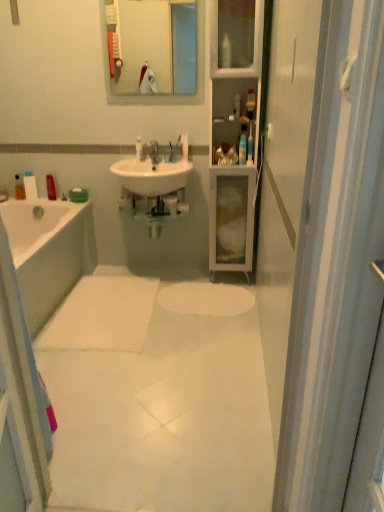
Locate an element on the screen. white smooth mat at center is located at coordinates (158, 396).

What is the approximate width of translucent plastic bottle at left, the first toiletry from the back?

It is 2.19 inches.

Identify the location of white glossy tap at center. The image size is (384, 512). (151, 151).

This screenshot has height=512, width=384. In order to click on white glossy bathtub at left in this screenshot , I will do `click(49, 253)`.

How different are the orientations of translucent plastic bottle at upper center, which ranks as the 6th toiletry in back-to-front order, and matte plastic bottle at left, the second toiletry in the back-to-front sequence, in degrees?

The angular difference between translucent plastic bottle at upper center, which ranks as the 6th toiletry in back-to-front order, and matte plastic bottle at left, the second toiletry in the back-to-front sequence, is 0.131 degrees.

Would you say translucent plastic bottle at upper center, the sixth toiletry viewed from the left, contains matte plastic bottle at left, which is the 4th toiletry from right to left?

That's incorrect, matte plastic bottle at left, which is the 4th toiletry from right to left, is not inside translucent plastic bottle at upper center, the sixth toiletry viewed from the left.

Is translucent plastic bottle at upper center, placed as the 1th toiletry when sorted from right to left, aimed at matte plastic bottle at left, which is the 4th toiletry from right to left?

No, translucent plastic bottle at upper center, placed as the 1th toiletry when sorted from right to left, is not turned towards matte plastic bottle at left, which is the 4th toiletry from right to left.

Is translucent plastic bottle at upper center, the sixth toiletry viewed from the left, at the left side of matte plastic bottle at left, positioned as the third toiletry in left-to-right order?

No.

Is white glossy tap at center looking in the opposite direction of clear glass mirror at upper center?

No, white glossy tap at center is not facing the opposite direction of clear glass mirror at upper center.

What's the angular difference between white glossy tap at center and clear glass mirror at upper center's facing directions?

white glossy tap at center and clear glass mirror at upper center are facing 1.52 degrees away from each other.

Is point (141, 153) closer to camera compared to point (201, 86)?

No.

This screenshot has width=384, height=512. I want to click on the 1st toiletry behind the translucent plastic bottle at upper center, positioned as the 2th toiletry in front-to-back order, counting from the anchor's position, so click(139, 148).

Is translucent plastic bottle at upper center, positioned as the fifth toiletry in left-to-right order, smaller than white plastic toothbrush at upper center, the fourth toiletry when ordered from back to front?

Yes, translucent plastic bottle at upper center, positioned as the fifth toiletry in left-to-right order, is smaller than white plastic toothbrush at upper center, the fourth toiletry when ordered from back to front.

Is translucent plastic bottle at upper center, positioned as the 2th toiletry in front-to-back order, oriented away from white plastic toothbrush at upper center, the third toiletry viewed from the right?

No.

Considering the positions of objects translucent plastic bottle at upper center, the second toiletry viewed from the right, and white plastic toothbrush at upper center, the fourth toiletry when ordered from back to front, in the image provided, who is more to the left, translucent plastic bottle at upper center, the second toiletry viewed from the right, or white plastic toothbrush at upper center, the fourth toiletry when ordered from back to front,?

Positioned to the left is white plastic toothbrush at upper center, the fourth toiletry when ordered from back to front.

Considering the positions of objects white glossy sink at center and white glossy tap at center in the image provided, who is more to the right, white glossy sink at center or white glossy tap at center?

From the viewer's perspective, white glossy tap at center appears more on the right side.

Can you see white glossy sink at center touching white glossy tap at center?

No, white glossy sink at center is not next to white glossy tap at center.

Is white glossy tap at center a part of white glossy sink at center?

That's incorrect, white glossy tap at center is not inside white glossy sink at center.

Is translucent plastic bottle at upper center, positioned as the fifth toiletry in left-to-right order, not inside white matte soap bar at left, marked as the 4th toiletry in a front-to-back arrangement?

translucent plastic bottle at upper center, positioned as the fifth toiletry in left-to-right order, is positioned outside white matte soap bar at left, marked as the 4th toiletry in a front-to-back arrangement.

Is translucent plastic bottle at upper center, the second toiletry viewed from the right, taller than white matte soap bar at left, which is the 2th toiletry in left-to-right order?

Incorrect, the height of translucent plastic bottle at upper center, the second toiletry viewed from the right, is not larger of that of white matte soap bar at left, which is the 2th toiletry in left-to-right order.

Looking at this image, which object is wider, translucent plastic bottle at upper center, positioned as the fifth toiletry in left-to-right order, or white matte soap bar at left, the 3th toiletry viewed from the back?

white matte soap bar at left, the 3th toiletry viewed from the back.

Looking at this image, is translucent plastic bottle at upper center, which appears as the 5th toiletry when viewed from the back, at the right side of white matte soap bar at left, marked as the 4th toiletry in a front-to-back arrangement?

Correct, you'll find translucent plastic bottle at upper center, which appears as the 5th toiletry when viewed from the back, to the right of white matte soap bar at left, marked as the 4th toiletry in a front-to-back arrangement.

Between matte plastic bottle at left, the 5th toiletry in the front-to-back sequence, and white plastic toothbrush at upper center, which ranks as the 4th toiletry in left-to-right order, which one has less height?

Standing shorter between the two is white plastic toothbrush at upper center, which ranks as the 4th toiletry in left-to-right order.

Looking at this image, relative to white plastic toothbrush at upper center, which ranks as the 4th toiletry in left-to-right order, is matte plastic bottle at left, which is the 4th toiletry from right to left, in front or behind?

Visually, matte plastic bottle at left, which is the 4th toiletry from right to left, is located behind white plastic toothbrush at upper center, which ranks as the 4th toiletry in left-to-right order.

Does matte plastic bottle at left, the second toiletry in the back-to-front sequence, turn towards white plastic toothbrush at upper center, the third toiletry viewed from the front?

No, matte plastic bottle at left, the second toiletry in the back-to-front sequence, is not oriented towards white plastic toothbrush at upper center, the third toiletry viewed from the front.

Considering the relative sizes of matte plastic bottle at left, the 5th toiletry in the front-to-back sequence, and white plastic toothbrush at upper center, the third toiletry viewed from the front, in the image provided, is matte plastic bottle at left, the 5th toiletry in the front-to-back sequence, wider than white plastic toothbrush at upper center, the third toiletry viewed from the front,?

Indeed, matte plastic bottle at left, the 5th toiletry in the front-to-back sequence, has a greater width compared to white plastic toothbrush at upper center, the third toiletry viewed from the front.

Is white soft bath mat at center looking in the opposite direction of white glossy bathtub at left?

Correct, white soft bath mat at center is looking away from white glossy bathtub at left.

Is white soft bath mat at center not near white glossy bathtub at left?

white soft bath mat at center is actually quite close to white glossy bathtub at left.

Does white soft bath mat at center lie in front of white glossy bathtub at left?

No, the depth of white soft bath mat at center is greater than that of white glossy bathtub at left.

Considering the points (94, 292) and (49, 240), which point is in front, point (94, 292) or point (49, 240)?

The point (49, 240) is closer to the camera.

At what (x,y) coordinates should I click in order to perform the action: click on the 4th toiletry behind the translucent plastic bottle at upper center, which ranks as the 6th toiletry in back-to-front order, counting from the anchor's position. Please return your answer as a coordinate pair (x, y). The image size is (384, 512). Looking at the image, I should click on (51, 187).

This screenshot has width=384, height=512. Identify the location of tap beneath the clear glass mirror at upper center (from a real-world perspective). (151, 151).

From the image, which object appears to be farther from white matte soap bar at left, marked as the 4th toiletry in a front-to-back arrangement, clear glass mirror at upper center or white plastic toothbrush at upper center, the fourth toiletry when ordered from back to front?

Based on the image, clear glass mirror at upper center appears to be further to white matte soap bar at left, marked as the 4th toiletry in a front-to-back arrangement.

In the scene shown: Based on their spatial positions, is white matte soap bar at left, marked as the 4th toiletry in a front-to-back arrangement, or white smooth mat at center further from translucent plastic bottle at left, which ranks as the sixth toiletry in right-to-left order?

white smooth mat at center is further to translucent plastic bottle at left, which ranks as the sixth toiletry in right-to-left order.

Considering their positions, is translucent plastic bottle at left, positioned as the sixth toiletry in front-to-back order, positioned further to white plastic toothbrush at upper center, which ranks as the 4th toiletry in left-to-right order, than white fabric shower curtain at left?

Among the two, white fabric shower curtain at left is located further to white plastic toothbrush at upper center, which ranks as the 4th toiletry in left-to-right order.

From the image, which object appears to be farther from white glossy sink at center, white glossy medicine cabinet at right or clear glass mirror at upper center?

Among the two, clear glass mirror at upper center is located further to white glossy sink at center.

Based on the photo, looking at the image, which one is located closer to translucent plastic bottle at left, the first toiletry in the left-to-right sequence, white glossy bathtub at left or white glossy sink at center?

The object closer to translucent plastic bottle at left, the first toiletry in the left-to-right sequence, is white glossy bathtub at left.

Estimate the real-world distances between objects in this image. Which object is further from white plastic toothbrush at upper center, the fourth toiletry when ordered from back to front, clear glass mirror at upper center or translucent plastic bottle at upper center, which ranks as the 6th toiletry in back-to-front order?

translucent plastic bottle at upper center, which ranks as the 6th toiletry in back-to-front order.

Considering their positions, is white glossy medicine cabinet at right positioned closer to white fabric shower curtain at left than white smooth mat at center?

white smooth mat at center.

From the image, which object appears to be nearer to translucent plastic bottle at upper center, which ranks as the 6th toiletry in back-to-front order, white glossy bathtub at left or white matte soap bar at left, which ranks as the fifth toiletry in right-to-left order?

white glossy bathtub at left is positioned closer to the anchor translucent plastic bottle at upper center, which ranks as the 6th toiletry in back-to-front order.

I want to click on bath mat situated between white matte soap bar at left, the 3th toiletry viewed from the back, and white glossy medicine cabinet at right from left to right, so click(x=102, y=315).

Image resolution: width=384 pixels, height=512 pixels. I want to click on tap between clear glass mirror at upper center and white soft bath mat at center from top to bottom, so click(151, 151).

Image resolution: width=384 pixels, height=512 pixels. Find the location of `plain between white fabric shower curtain at left and white soft bath mat at center along the z-axis`. plain between white fabric shower curtain at left and white soft bath mat at center along the z-axis is located at coordinates (158, 396).

I want to click on mirror between white fabric shower curtain at left and translucent plastic bottle at left, which ranks as the sixth toiletry in right-to-left order, in the front-back direction, so click(159, 95).